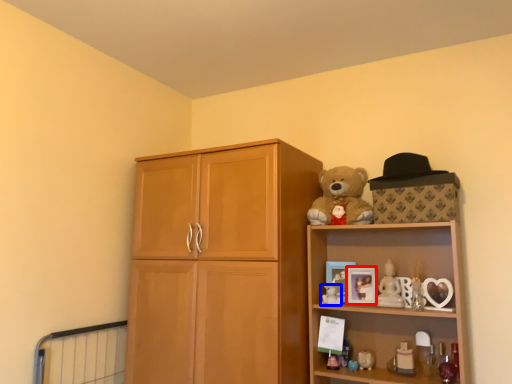
Question: Among these objects, which one is farthest to the camera, picture frame (highlighted by a red box) or toy (highlighted by a blue box)?

Choices:
 (A) picture frame
 (B) toy

Answer: (A)